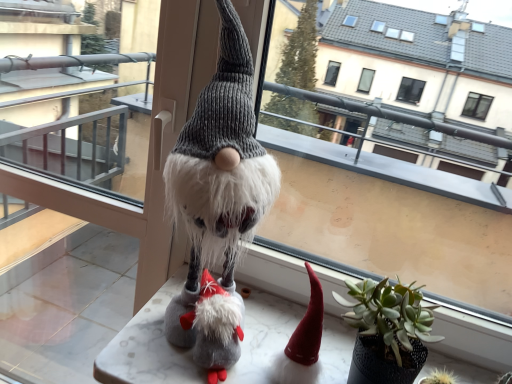
Question: Can you confirm if marble table at center is wider than transparent glass door at center?

Choices:
 (A) no
 (B) yes

Answer: (B)

Question: Does marble table at center lie in front of transparent glass door at center?

Choices:
 (A) yes
 (B) no

Answer: (A)

Question: Does marble table at center have a lesser width compared to transparent glass door at center?

Choices:
 (A) no
 (B) yes

Answer: (A)

Question: Is marble table at center oriented away from transparent glass door at center?

Choices:
 (A) yes
 (B) no

Answer: (B)

Question: Is marble table at center shorter than transparent glass door at center?

Choices:
 (A) no
 (B) yes

Answer: (B)

Question: Does point (143, 372) appear closer or farther from the camera than point (264, 200)?

Choices:
 (A) closer
 (B) farther

Answer: (B)

Question: Is marble table at center to the left or to the right of fuzzy gray knit gnome at center in the image?

Choices:
 (A) left
 (B) right

Answer: (B)

Question: Looking at their shapes, would you say marble table at center is wider or thinner than fuzzy gray knit gnome at center?

Choices:
 (A) wide
 (B) thin

Answer: (A)

Question: From a real-world perspective, is marble table at center physically located above or below fuzzy gray knit gnome at center?

Choices:
 (A) above
 (B) below

Answer: (B)

Question: Is green matte houseplant at center taller or shorter than fuzzy gray knit gnome at center?

Choices:
 (A) tall
 (B) short

Answer: (B)

Question: Is point (420, 322) closer or farther from the camera than point (236, 233)?

Choices:
 (A) farther
 (B) closer

Answer: (A)

Question: Based on their sizes in the image, would you say green matte houseplant at center is bigger or smaller than fuzzy gray knit gnome at center?

Choices:
 (A) small
 (B) big

Answer: (A)

Question: In terms of width, does green matte houseplant at center look wider or thinner when compared to fuzzy gray knit gnome at center?

Choices:
 (A) wide
 (B) thin

Answer: (B)

Question: Would you say fuzzy gray knit gnome at center is to the left or to the right of transparent glass door at center in the picture?

Choices:
 (A) right
 (B) left

Answer: (A)

Question: Considering the positions of point (176, 157) and point (104, 130), is point (176, 157) closer or farther from the camera than point (104, 130)?

Choices:
 (A) farther
 (B) closer

Answer: (B)